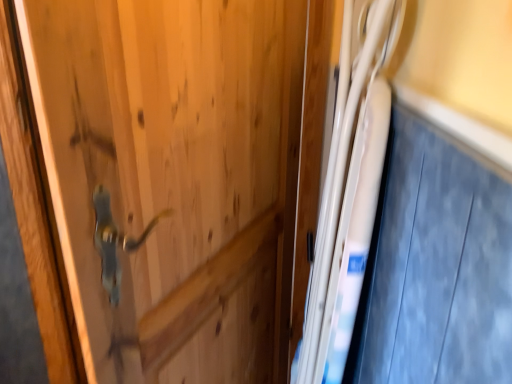
Question: Is white glossy fridge at right taller or shorter than white glossy bed at right?

Choices:
 (A) tall
 (B) short

Answer: (A)

Question: Based on their sizes in the image, would you say white glossy fridge at right is bigger or smaller than white glossy bed at right?

Choices:
 (A) big
 (B) small

Answer: (A)

Question: From the image's perspective, is white glossy fridge at right above or below white glossy bed at right?

Choices:
 (A) below
 (B) above

Answer: (A)

Question: Looking at their shapes, would you say white glossy bed at right is wider or thinner than white glossy fridge at right?

Choices:
 (A) wide
 (B) thin

Answer: (B)

Question: Visually, is white glossy bed at right positioned to the left or to the right of white glossy fridge at right?

Choices:
 (A) right
 (B) left

Answer: (A)

Question: From their relative heights in the image, would you say white glossy bed at right is taller or shorter than white glossy fridge at right?

Choices:
 (A) tall
 (B) short

Answer: (B)

Question: Is white glossy bed at right bigger or smaller than white glossy fridge at right?

Choices:
 (A) big
 (B) small

Answer: (B)